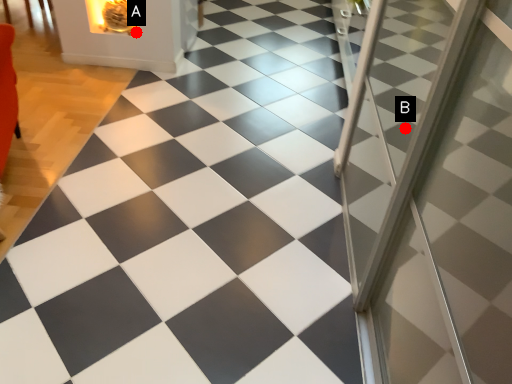
Question: Two points are circled on the image, labeled by A and B beside each circle. Which point appears farthest from the camera in this image?

Choices:
 (A) A is further
 (B) B is further

Answer: (A)